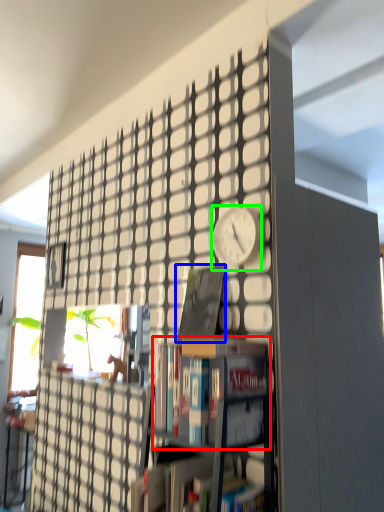
Question: Estimate the real-world distances between objects in this image. Which object is farther from book (highlighted by a red box), book (highlighted by a blue box) or clock (highlighted by a green box)?

Choices:
 (A) book
 (B) clock

Answer: (B)